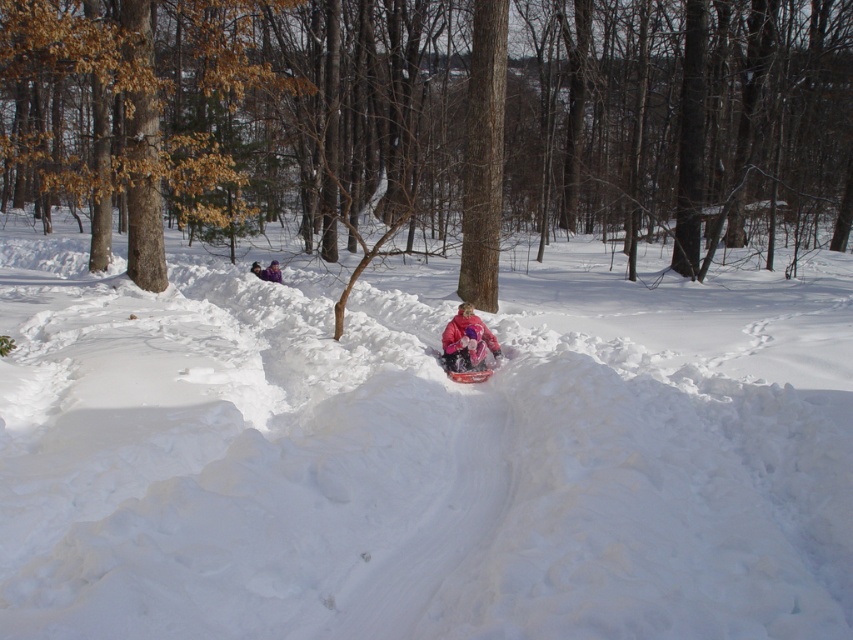
You are a photographer standing at the bottom of the slope. You want to take a photo of both the white fluffy snow at center and the pink fleece jacket at center. Which object should you adjust your camera to focus on first if you want to capture both in the same frame?

The white fluffy snow at center is to the right of the pink fleece jacket at center, so you should focus on the pink fleece jacket at center first to ensure both are in the same frame.

Based on the photo, you are a photographer trying to capture the children sledding. You want to ensure the pink fleece jacket at center is in focus while keeping the white fluffy snow at center as a blurred background. Is this possible given their positions?

The white fluffy snow at center is in front of the pink fleece jacket at center, so it would be difficult to blur the snow while keeping the jacket in focus. The jacket is behind the snow, so adjusting focus might require prioritizing the jacket over the snow.